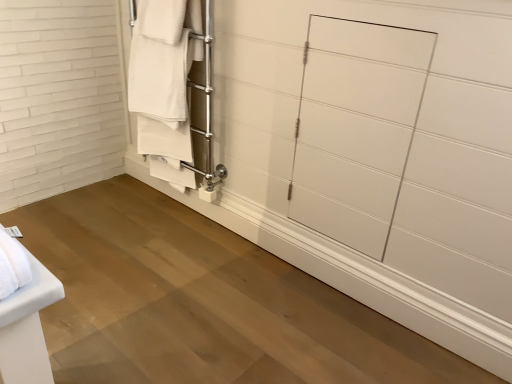
Question: Is white matte towel rack at upper left spatially inside white glossy door at center, or outside of it?

Choices:
 (A) outside
 (B) inside

Answer: (A)

Question: From the image's perspective, is white matte towel rack at upper left positioned above or below white glossy door at center?

Choices:
 (A) above
 (B) below

Answer: (A)

Question: Is white matte towel rack at upper left in front of or behind white glossy door at center in the image?

Choices:
 (A) behind
 (B) front

Answer: (A)

Question: Relative to white matte towel rack at upper left, is white glossy door at center in front or behind?

Choices:
 (A) behind
 (B) front

Answer: (B)

Question: Is point (376, 165) closer or farther from the camera than point (154, 8)?

Choices:
 (A) closer
 (B) farther

Answer: (A)

Question: Is white glossy door at center bigger or smaller than white matte towel rack at upper left?

Choices:
 (A) big
 (B) small

Answer: (B)

Question: Is white glossy door at center to the left or to the right of white matte towel rack at upper left in the image?

Choices:
 (A) right
 (B) left

Answer: (A)